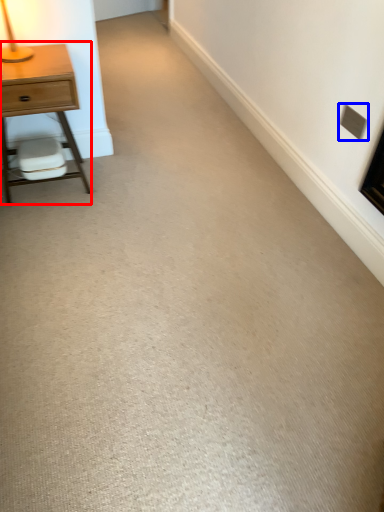
Question: Which object is further to the camera taking this photo, nightstand (highlighted by a red box) or electric outlet (highlighted by a blue box)?

Choices:
 (A) nightstand
 (B) electric outlet

Answer: (B)